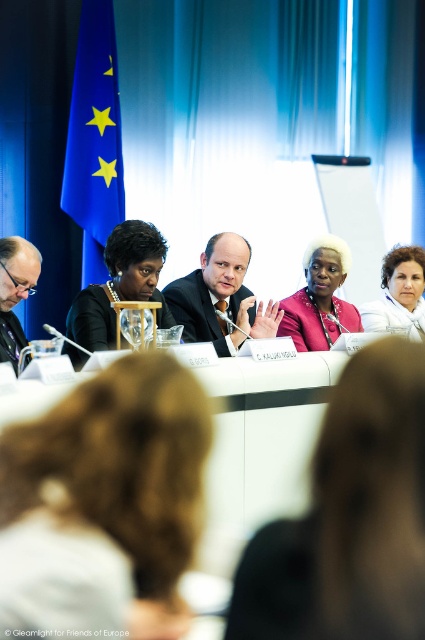
Question: Which object is the closest to the blue fabric flag at left?

Choices:
 (A) black satin dress at center
 (B) pink matte jacket at center
 (C) pink fabric at center
 (D) white matte jacket at upper right

Answer: (B)

Question: Considering the real-world distances, which object is closest to the smooth black suit at center?

Choices:
 (A) blue fabric flag at left
 (B) matte black glasses at left

Answer: (B)

Question: Observing the image, what is the correct spatial positioning of blue fabric flag at left in reference to black satin dress at center?

Choices:
 (A) right
 (B) left

Answer: (B)

Question: Which point appears farthest from the camera in this image?

Choices:
 (A) (195, 380)
 (B) (8, 340)
 (C) (93, 177)

Answer: (C)

Question: Is pink matte jacket at center to the right of white matte jacket at upper right from the viewer's perspective?

Choices:
 (A) no
 (B) yes

Answer: (A)

Question: Can you confirm if pink fabric at center is thinner than smooth black suit at center?

Choices:
 (A) no
 (B) yes

Answer: (B)